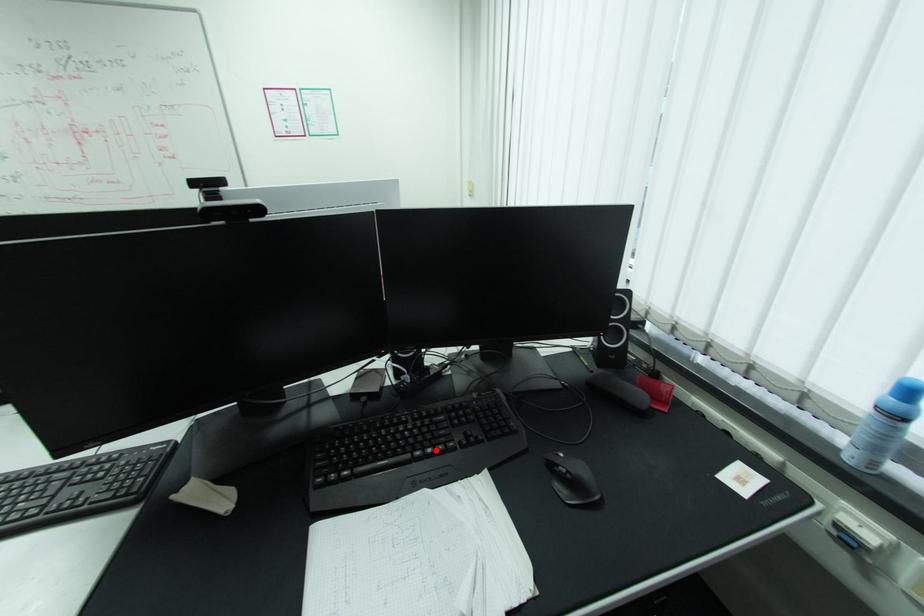
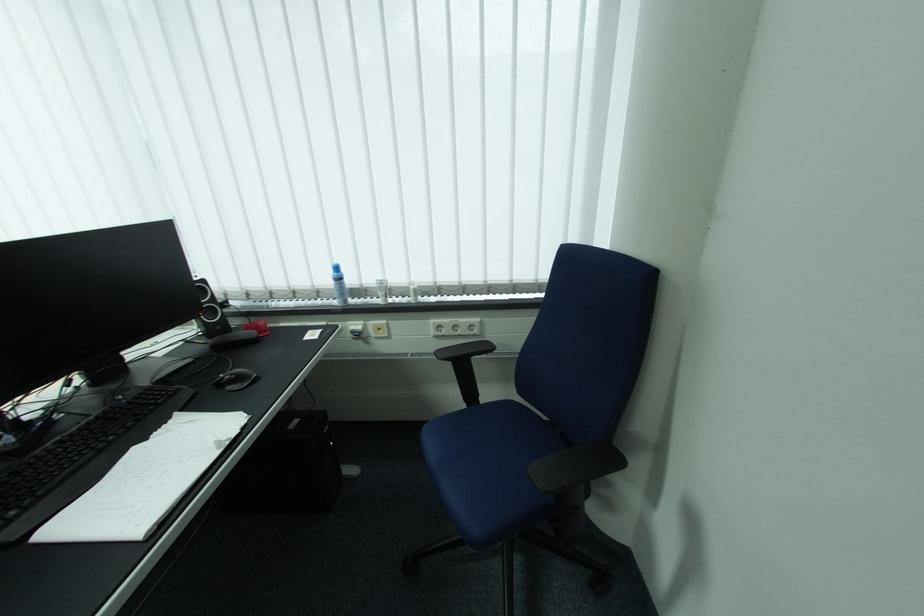
Where in the second image is the point corresponding to the highlighted location from the first image?

(117, 438)